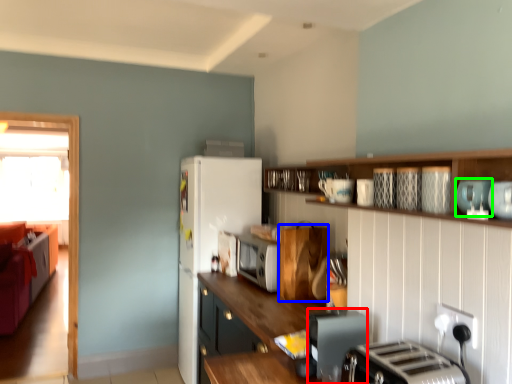
Question: Considering the real-world distances, which object is closest to appliance (highlighted by a red box)? cabinetry (highlighted by a blue box) or appliance (highlighted by a green box).

Choices:
 (A) cabinetry
 (B) appliance

Answer: (B)